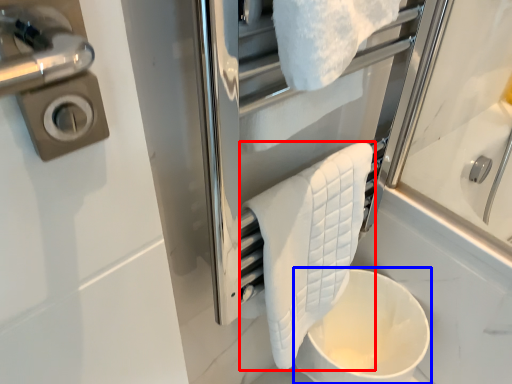
Question: Which of the following is the farthest to the observer, towel (highlighted by a red box) or toilet bowl (highlighted by a blue box)?

Choices:
 (A) towel
 (B) toilet bowl

Answer: (B)